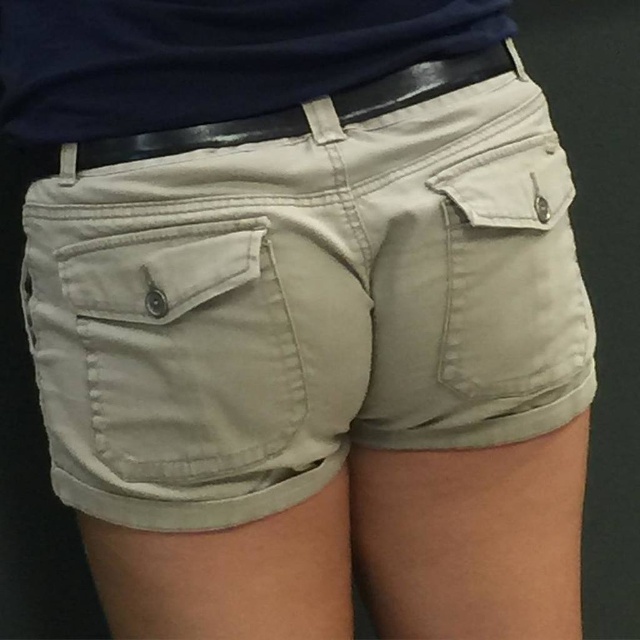
Could you measure the distance between light beige cotton pocket at lower center and black leather belt at upper center?

light beige cotton pocket at lower center is 11.82 centimeters away from black leather belt at upper center.

Which is in front, point (86, 266) or point (301, 129)?

Positioned in front is point (86, 266).

Identify the location of light beige cotton pocket at lower center. Image resolution: width=640 pixels, height=640 pixels. (157, 272).

Is point (237, 230) in front of point (531, 154)?

Yes, it is.

Which is more to the right, light beige cotton pocket at lower center or matte beige pocket at right?

matte beige pocket at right

I want to click on light beige cotton pocket at lower center, so click(157, 272).

Locate an element on the screen. The height and width of the screenshot is (640, 640). light beige cotton pocket at lower center is located at coordinates (157, 272).

At what (x,y) coordinates should I click in order to perform the action: click on black leather belt at upper center. Please return your answer as a coordinate pair (x, y). The width and height of the screenshot is (640, 640). Looking at the image, I should click on (189, 138).

Does black leather belt at upper center have a lesser width compared to matte beige pocket at right?

In fact, black leather belt at upper center might be wider than matte beige pocket at right.

The image size is (640, 640). What do you see at coordinates (189, 138) in the screenshot?
I see `black leather belt at upper center` at bounding box center [189, 138].

This screenshot has width=640, height=640. I want to click on black leather belt at upper center, so click(x=189, y=138).